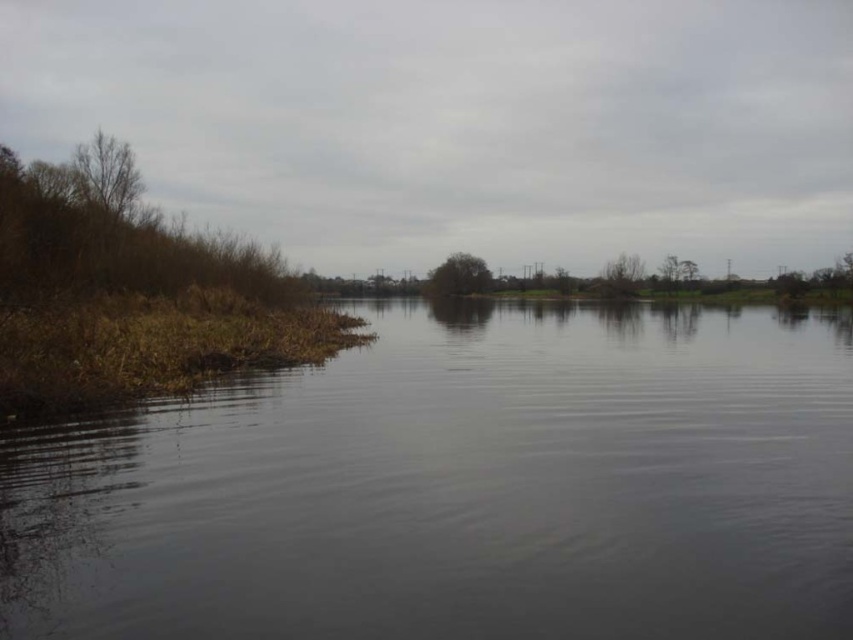
Is dark water at center taller than bare branches at left?

No.

Is dark water at center shorter than bare branches at left?

Yes, dark water at center is shorter than bare branches at left.

Locate an element on the screen. The height and width of the screenshot is (640, 853). dark water at center is located at coordinates (x=460, y=486).

Between bare branches at left and green leafy tree at center, which one has less height?

Standing shorter between the two is green leafy tree at center.

Can you confirm if bare branches at left is smaller than green leafy tree at center?

Indeed, bare branches at left has a smaller size compared to green leafy tree at center.

You are a GUI agent. You are given a task and a screenshot of the screen. Output one action in this format:
    pyautogui.click(x=<x>, y=<y>)
    Task: Click on the bare branches at left
    This screenshot has height=640, width=853.
    Given the screenshot: What is the action you would take?
    pyautogui.click(x=107, y=173)

This screenshot has height=640, width=853. I want to click on bare branches at left, so click(x=107, y=173).

Who is more forward, (86,186) or (439,282)?

Point (86,186) is more forward.

Is bare branches at left positioned before green matte tree at center?

Yes.

Which is behind, point (112, 150) or point (447, 278)?

Positioned behind is point (447, 278).

Find the location of a particular element. This screenshot has height=640, width=853. bare branches at left is located at coordinates (107, 173).